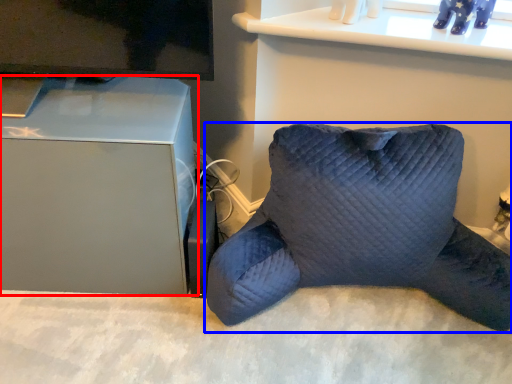
Question: Which object appears farthest to the camera in this image, furniture (highlighted by a red box) or pillow (highlighted by a blue box)?

Choices:
 (A) furniture
 (B) pillow

Answer: (A)